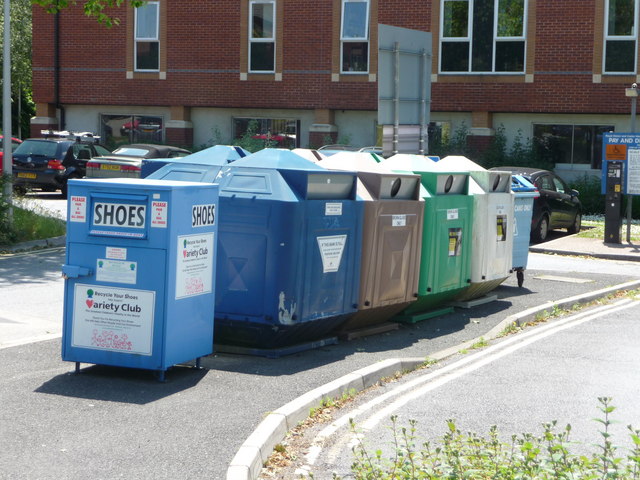
At what (x,y) coordinates should I click in order to perform the action: click on opening window. Please return your answer as a coordinate pair (x, y). The image size is (640, 480). Looking at the image, I should click on (617, 57), (507, 55), (457, 51), (349, 51), (256, 47), (143, 57).